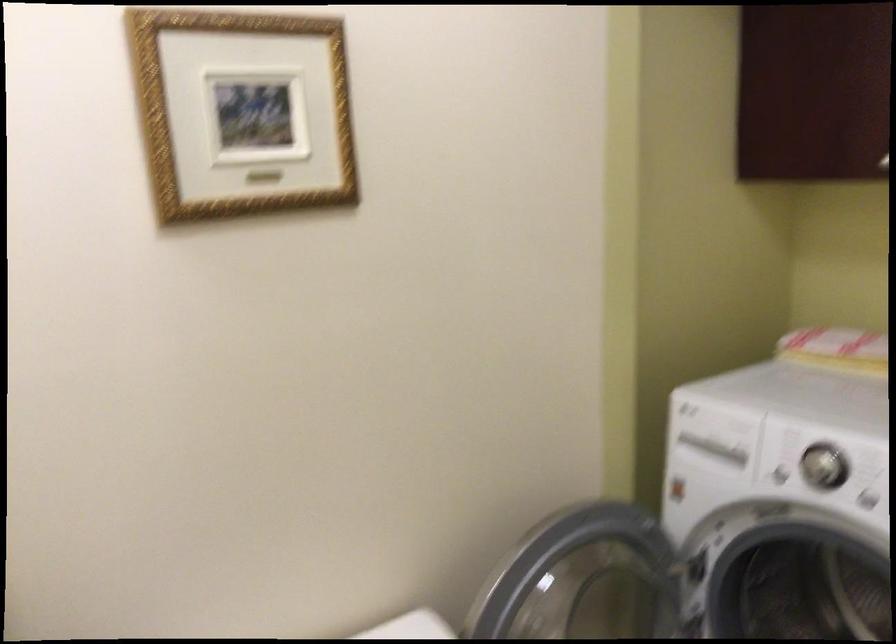
I want to click on washing machine door, so click(583, 579).